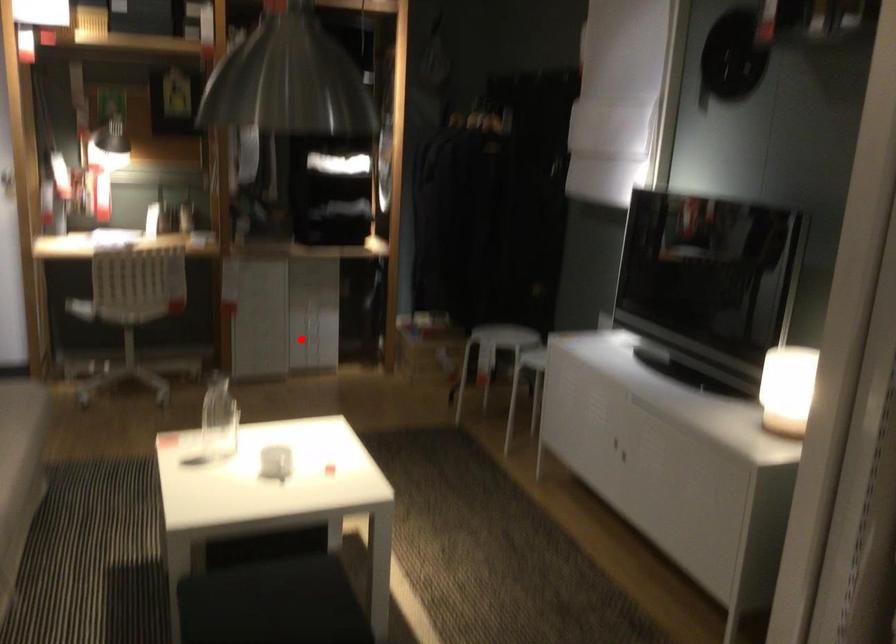
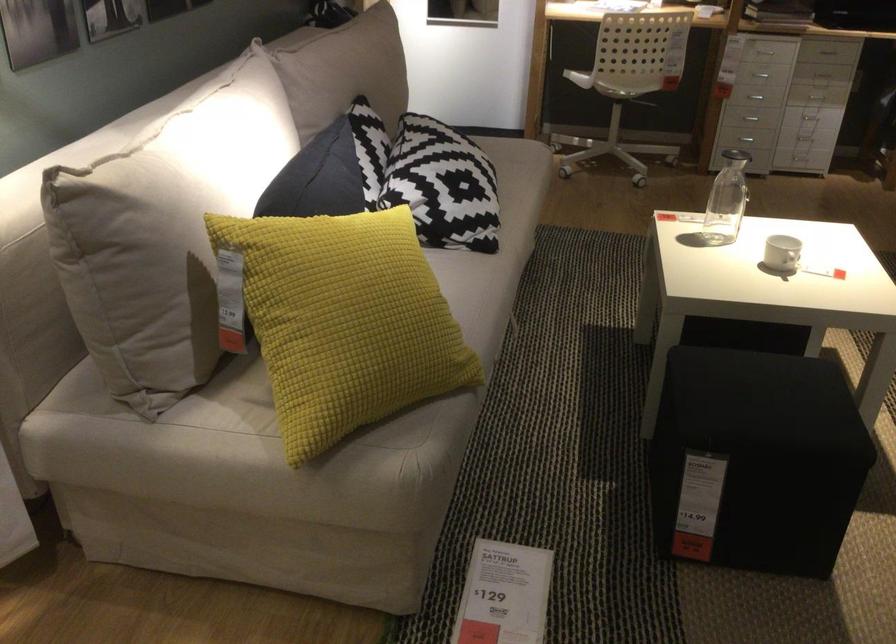
The point at the highlighted location is marked in the first image. Where is the corresponding point in the second image?

(810, 118)